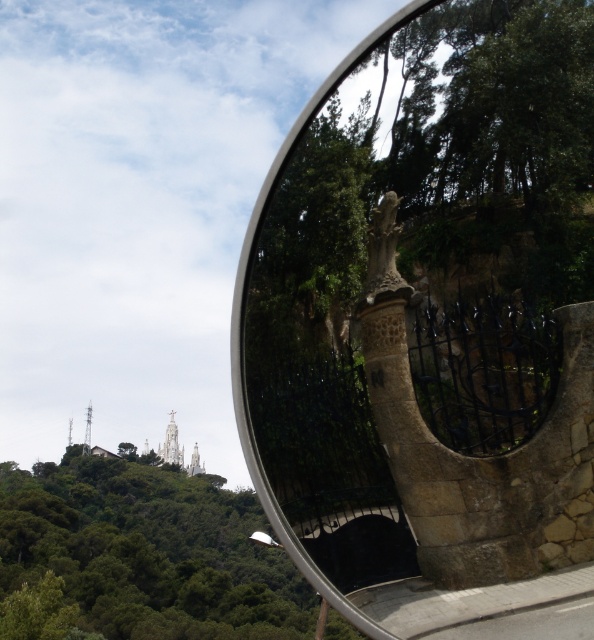
You are a photographer trying to capture the stone statue at center and the green leafy tree at upper center in the same frame. Based on their positions, which object should appear closer to the top of your photo?

The green leafy tree at upper center should appear closer to the top of the photo because the stone statue at center is positioned over it, meaning the tree is lower in the frame.

Based on the photo, you are standing in front of a convex traffic mirror that reflects a scenic landscape. You notice a stone statue at center in the reflection. Based on the mirror, can you determine the actual direction of the statue relative to your current position?

The stone statue at center is located behind the convex traffic mirror, as convex mirrors reflect images behind them.